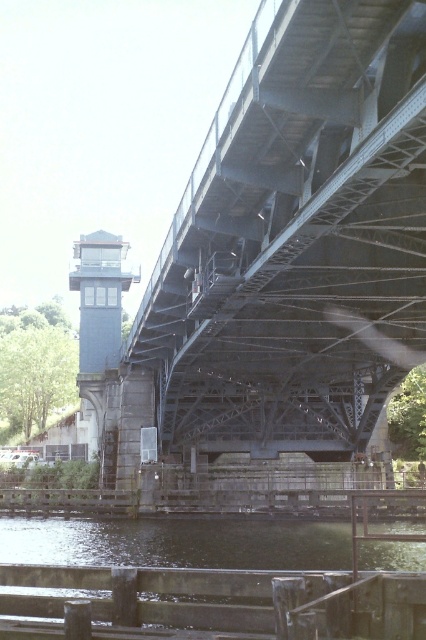
Is metallic gray bridge at center thinner than dark green concrete river at lower center?

No, metallic gray bridge at center is not thinner than dark green concrete river at lower center.

Does metallic gray bridge at center have a smaller size compared to dark green concrete river at lower center?

No.

Who is more forward, (336, 273) or (124, 595)?

Point (124, 595)

Find the location of a particular element. The height and width of the screenshot is (640, 426). metallic gray bridge at center is located at coordinates (288, 250).